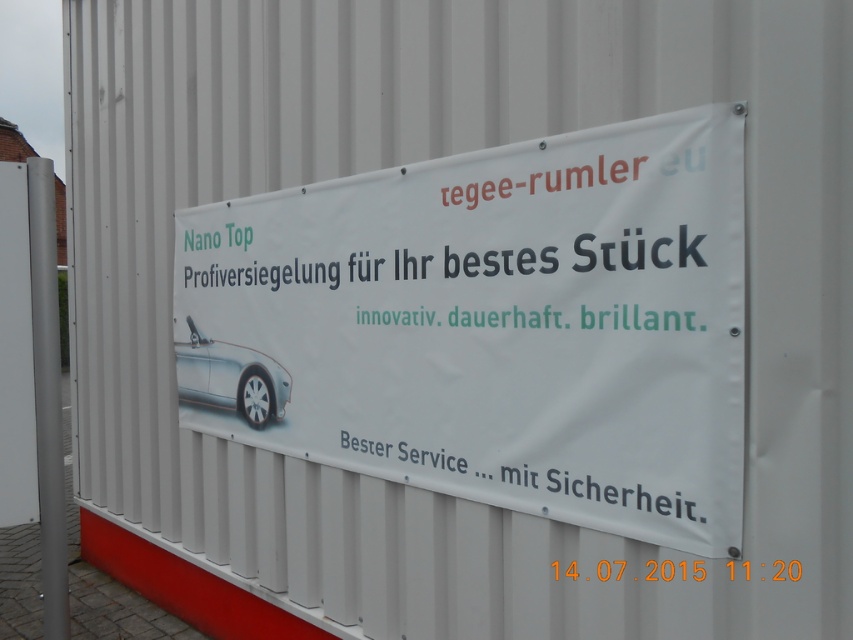
You are a photographer standing in front of the white matte banner at center and the silver metallic car at center. You want to take a photo of both objects but ensure the banner is in focus while the car is slightly blurred. Which object should you focus on to achieve this effect?

You should focus on the white matte banner at center because it is closer to the viewer than the silver metallic car at center, so focusing on it will keep the banner sharp while the car becomes blurred in the background.

You are a photographer standing in front of the white matte banner at center and the silver metallic car at center. You want to capture a photo where both objects are visible. Considering their sizes, which object will occupy more vertical space in the photo?

The white matte banner at center has a greater height compared to the silver metallic car at center, so it will occupy more vertical space in the photo.